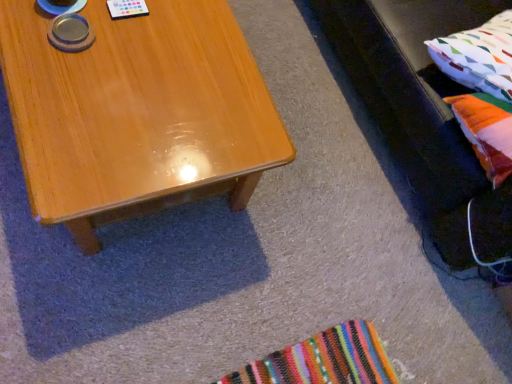
This screenshot has width=512, height=384. Identify the location of free location to the right of shiny wood coffee table at center. (301, 235).